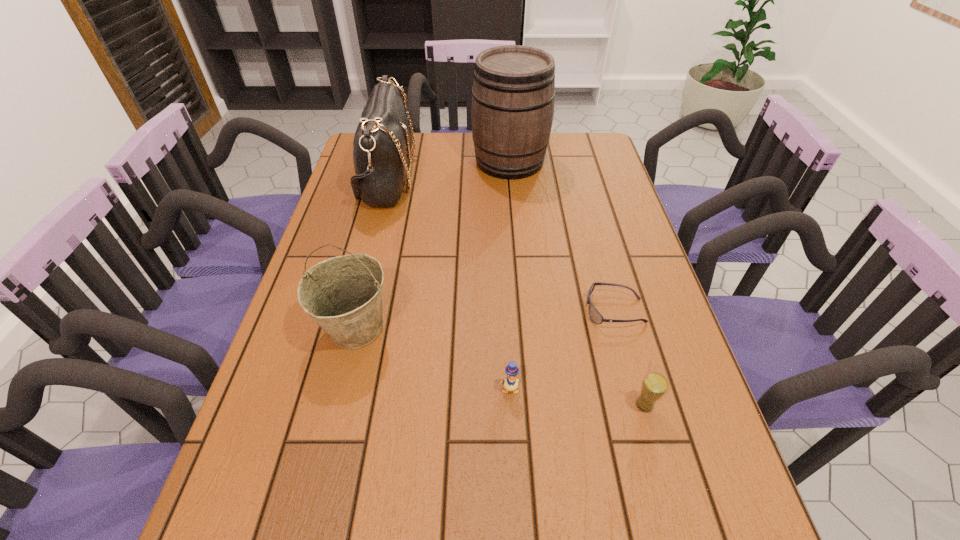
This screenshot has width=960, height=540. What are the coordinates of `vacant area that lies between the fourth tallest object and the second shortest object` in the screenshot? It's located at (577, 397).

Locate an element on the screen. This screenshot has width=960, height=540. free spot between the tallest object and the sunglasses is located at coordinates (563, 235).

You are a GUI agent. You are given a task and a screenshot of the screen. Output one action in this format:
    pyautogui.click(x=<x>, y=<y>)
    Task: Click on the vacant space in between the handbag and the sunglasses
    
    Given the screenshot: What is the action you would take?
    pyautogui.click(x=501, y=244)

The image size is (960, 540). I want to click on free space between the sunglasses and the tallest object, so click(563, 235).

I want to click on free space between the left wine bucket and the handbag, so click(372, 252).

Find the location of a particular element. This screenshot has width=960, height=540. vacant space that is in between the second shortest object and the left wine bucket is located at coordinates (433, 358).

Locate an element on the screen. The width and height of the screenshot is (960, 540). free space that is in between the handbag and the straw for drinking is located at coordinates (516, 291).

Where is `object identified as the fourth closest to the straw for drinking`? The image size is (960, 540). object identified as the fourth closest to the straw for drinking is located at coordinates (513, 93).

What are the coordinates of `object that is the third closest to the duckling` in the screenshot? It's located at (343, 295).

The height and width of the screenshot is (540, 960). I want to click on free spot that satisfies the following two spatial constraints: 1. on the front side of the third shortest object; 2. on the right side of the tallest object, so (531, 405).